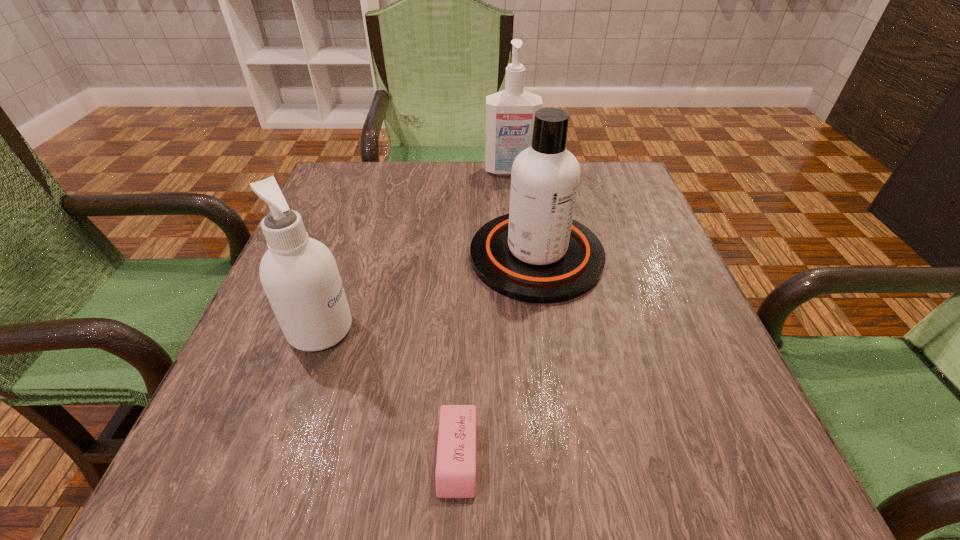
Find the location of a particular element. The height and width of the screenshot is (540, 960). the farthest object is located at coordinates (510, 113).

Find the location of a particular element. the second farthest object is located at coordinates (537, 253).

Locate an element on the screen. the second nearest object is located at coordinates (299, 274).

Where is `the nearest cleansing agent`? The height and width of the screenshot is (540, 960). the nearest cleansing agent is located at coordinates (x=299, y=274).

Identify the location of the shortest object. click(455, 476).

Identify the location of the nearest object. Image resolution: width=960 pixels, height=540 pixels. (455, 476).

You are a GUI agent. You are given a task and a screenshot of the screen. Output one action in this format:
    pyautogui.click(x=<x>, y=<y>)
    Task: Click on the free space located 0.310m on the front label of the farthest cleansing agent
    This screenshot has height=540, width=960.
    Given the screenshot: What is the action you would take?
    pyautogui.click(x=518, y=253)

Locate an element on the screen. This screenshot has width=960, height=540. vacant space located 0.120m on the left of the second farthest object is located at coordinates (415, 256).

Image resolution: width=960 pixels, height=540 pixels. I want to click on free space located 0.110m on the front label of the nearest cleansing agent, so click(413, 329).

Find the location of `blank area located on the right of the eraser`. blank area located on the right of the eraser is located at coordinates (664, 456).